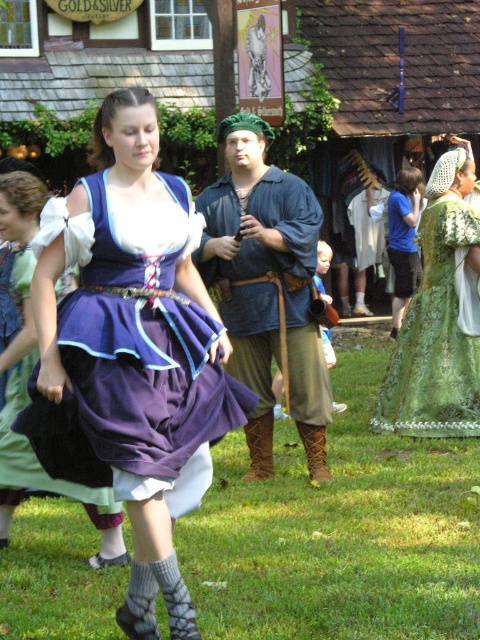
Question: Considering the real-world distances, which object is farthest from the matte purple dress at center?

Choices:
 (A) purple satin dress at center
 (B) blue cotton shirt at center

Answer: (B)

Question: Based on their relative distances, which object is nearer to the matte purple dress at center?

Choices:
 (A) purple satin dress at center
 (B) green textured fabric dress at center
 (C) blue cotton shirt at right

Answer: (A)

Question: Does green grass at lower center appear on the left side of green textured fabric dress at center?

Choices:
 (A) no
 (B) yes

Answer: (B)

Question: Does matte purple dress at center have a smaller size compared to blue cotton shirt at right?

Choices:
 (A) yes
 (B) no

Answer: (B)

Question: Among these objects, which one is nearest to the camera?

Choices:
 (A) green grass at lower center
 (B) green textured fabric dress at center
 (C) matte purple dress at center

Answer: (A)

Question: Where is matte purple dress at center located in relation to blue cotton shirt at right in the image?

Choices:
 (A) above
 (B) below

Answer: (B)